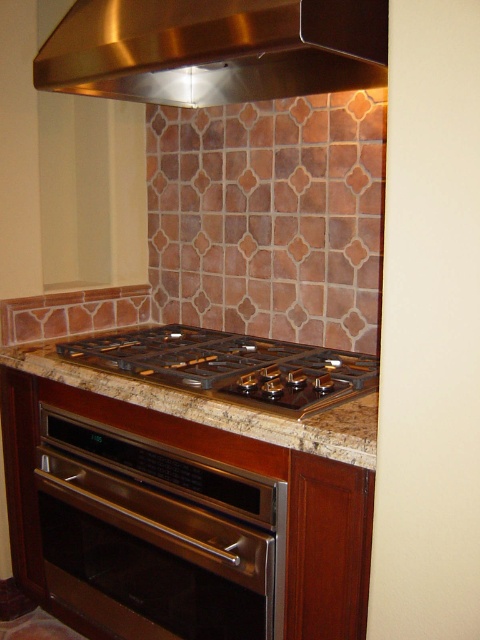
Is stainless steel oven at lower left positioned at the back of stainless steel exhaust hood at upper center?

That is True.

Consider the image. Who is lower down, stainless steel oven at lower left or stainless steel exhaust hood at upper center?

Positioned lower is stainless steel oven at lower left.

Locate an element on the screen. The image size is (480, 640). stainless steel oven at lower left is located at coordinates (163, 531).

The width and height of the screenshot is (480, 640). What are the coordinates of `stainless steel oven at lower left` in the screenshot? It's located at (163, 531).

Is stainless steel exhaust hood at upper center wider than marble/granite counter top at center?

In fact, stainless steel exhaust hood at upper center might be narrower than marble/granite counter top at center.

Is point (45, 61) closer to camera compared to point (307, 362)?

That is True.

The image size is (480, 640). I want to click on stainless steel exhaust hood at upper center, so pos(215,49).

Who is taller, stainless steel oven at lower left or marble/granite counter top at center?

Standing taller between the two is stainless steel oven at lower left.

Is stainless steel oven at lower left positioned at the back of marble/granite counter top at center?

Yes, stainless steel oven at lower left is further from the viewer.

Between point (110, 532) and point (349, 362), which one is positioned behind?

The point (349, 362) is behind.

Where is `stainless steel oven at lower left`? stainless steel oven at lower left is located at coordinates (163, 531).